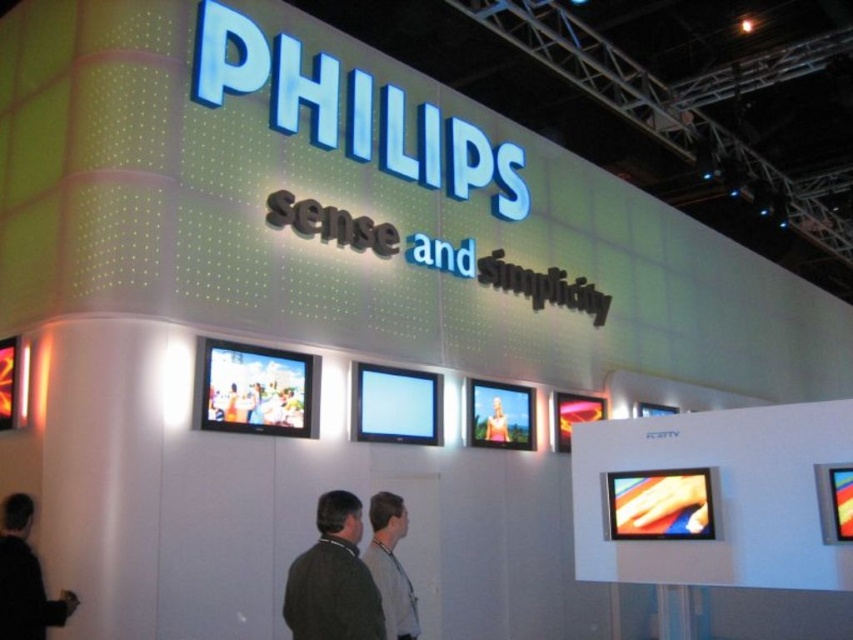
You are a photographer at the Philips event. You need to capture a photo of the smooth skin person at center and the gray fabric shirt at lower center. Can you frame both in the same shot without moving the camera?

The gray fabric shirt at lower center is below the smooth skin person at center, so yes, you can frame both in the same shot without moving the camera since the shirt is positioned directly underneath the person.

You are a fashion designer looking at the Philips promotional display. You notice two items at the lower center of the display. What is the spatial relationship between the dark gray sweater at lower center and the gray fabric shirt at lower center?

The dark gray sweater at lower center is positioned on the left side of the gray fabric shirt at lower center.

You are a photographer at the Philips event. You need to capture a photo where the gray fabric shirt at lower center and the smooth skin person at center are both visible. Which object should you focus on to ensure both are in frame?

The gray fabric shirt at lower center is bigger than the smooth skin person at center, so focus on the gray fabric shirt at lower center to ensure both are in frame.